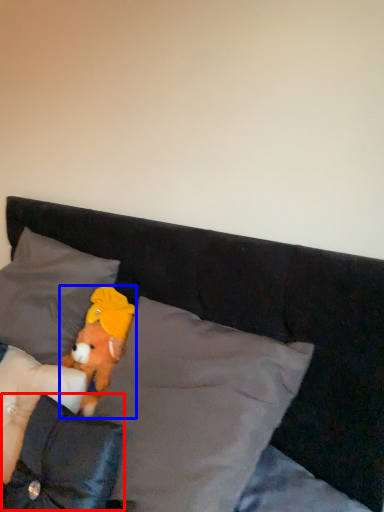
Question: Which object appears closest to the camera in this image, pillow (highlighted by a red box) or teddy bear (highlighted by a blue box)?

Choices:
 (A) pillow
 (B) teddy bear

Answer: (A)